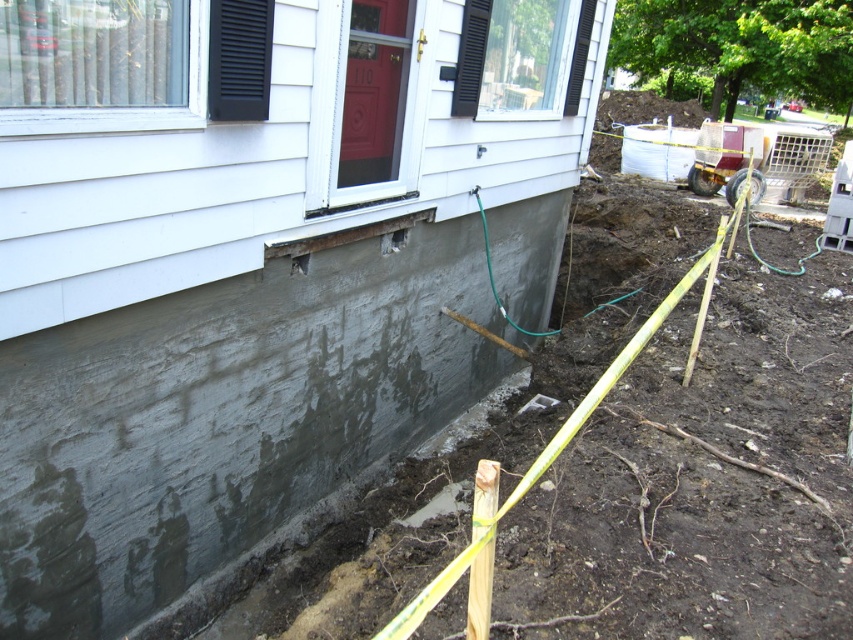
Question: Is gray concrete foundation at lower left below rusty metal hole at lower center?

Choices:
 (A) yes
 (B) no

Answer: (A)

Question: Which point appears farthest from the camera in this image?

Choices:
 (A) (260, 348)
 (B) (291, 264)

Answer: (B)

Question: Does gray concrete foundation at lower left appear over rusty metal hole at lower center?

Choices:
 (A) no
 (B) yes

Answer: (A)

Question: Does gray concrete foundation at lower left have a smaller size compared to rusty metal hole at lower center?

Choices:
 (A) no
 (B) yes

Answer: (A)

Question: Which point is closer to the camera taking this photo?

Choices:
 (A) (384, 428)
 (B) (308, 262)

Answer: (B)